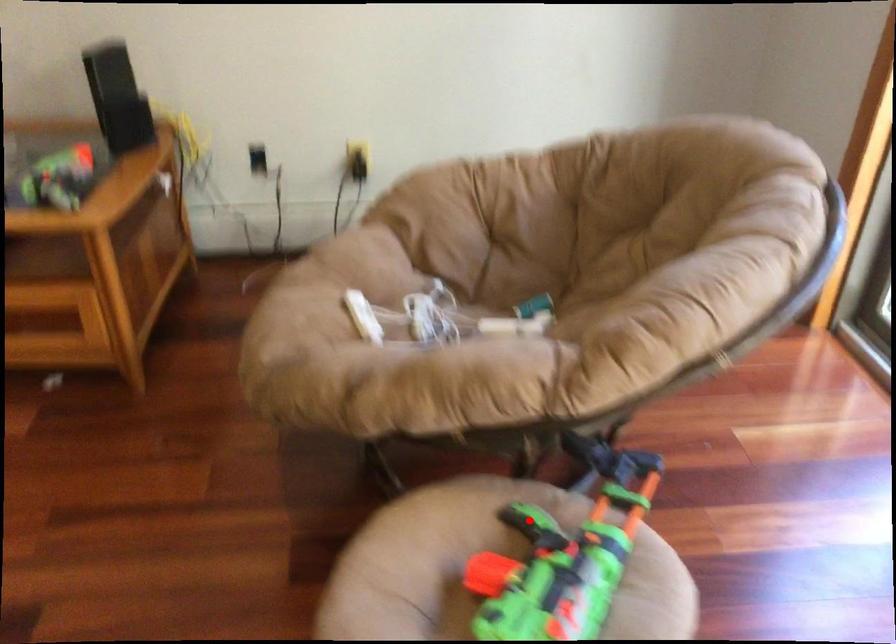
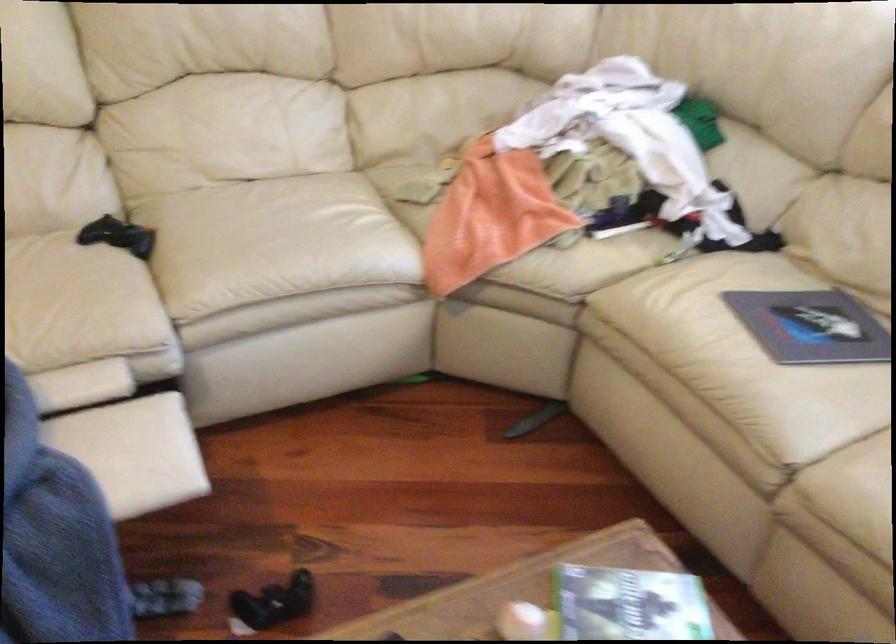
Question: I am providing you with two images of the same scene from different viewpoints. A red point is marked on the first image. Is the red point's position out of view in image 2?

Choices:
 (A) Yes
 (B) No

Answer: (A)